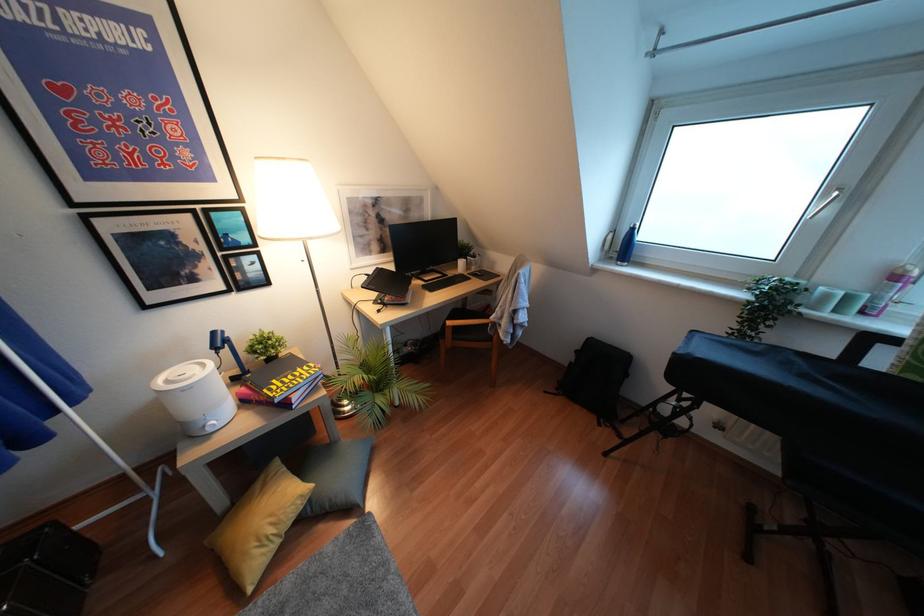
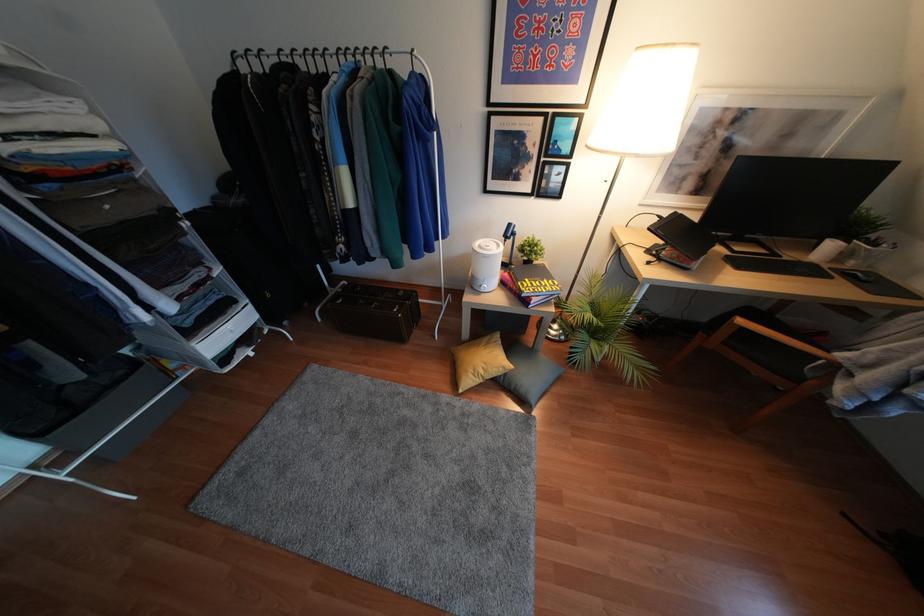
The point at (275, 400) is marked in the first image. Where is the corresponding point in the second image?

(523, 294)